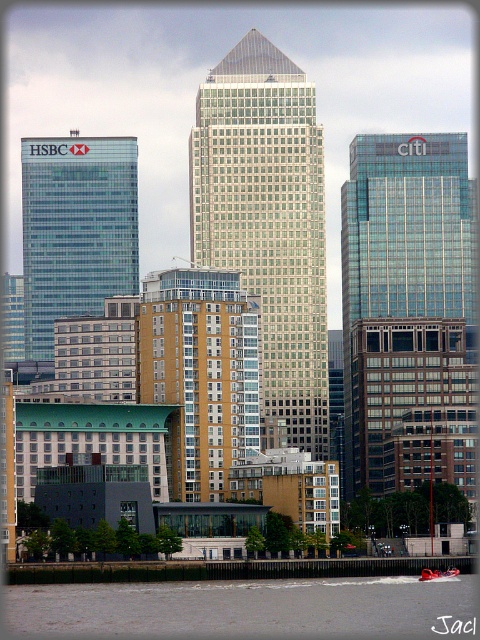
Is glassy silver skyscraper at center taller than glassy blue skyscraper at left?

Indeed, glassy silver skyscraper at center has a greater height compared to glassy blue skyscraper at left.

Can you confirm if glassy silver skyscraper at center is wider than glassy blue skyscraper at left?

In fact, glassy silver skyscraper at center might be narrower than glassy blue skyscraper at left.

Describe the element at coordinates (267, 225) in the screenshot. Image resolution: width=480 pixels, height=640 pixels. I see `glassy silver skyscraper at center` at that location.

Identify the location of glassy silver skyscraper at center. Image resolution: width=480 pixels, height=640 pixels. (267, 225).

Does glassy silver skyscraper at center have a lesser width compared to gray concrete waterway at lower left?

Correct, glassy silver skyscraper at center's width is less than gray concrete waterway at lower left's.

From the picture: Between glassy silver skyscraper at center and gray concrete waterway at lower left, which one appears on the left side from the viewer's perspective?

gray concrete waterway at lower left is more to the left.

Does point (225, 92) lie behind point (411, 618)?

Yes, point (225, 92) is behind point (411, 618).

I want to click on glassy silver skyscraper at center, so click(267, 225).

Who is taller, gray concrete waterway at lower left or glassy blue skyscraper at left?

Standing taller between the two is glassy blue skyscraper at left.

Does gray concrete waterway at lower left lie behind glassy blue skyscraper at left?

That is False.

I want to click on gray concrete waterway at lower left, so click(x=247, y=605).

At what (x,y) coordinates should I click in order to perform the action: click on gray concrete waterway at lower left. Please return your answer as a coordinate pair (x, y). Looking at the image, I should click on (247, 605).